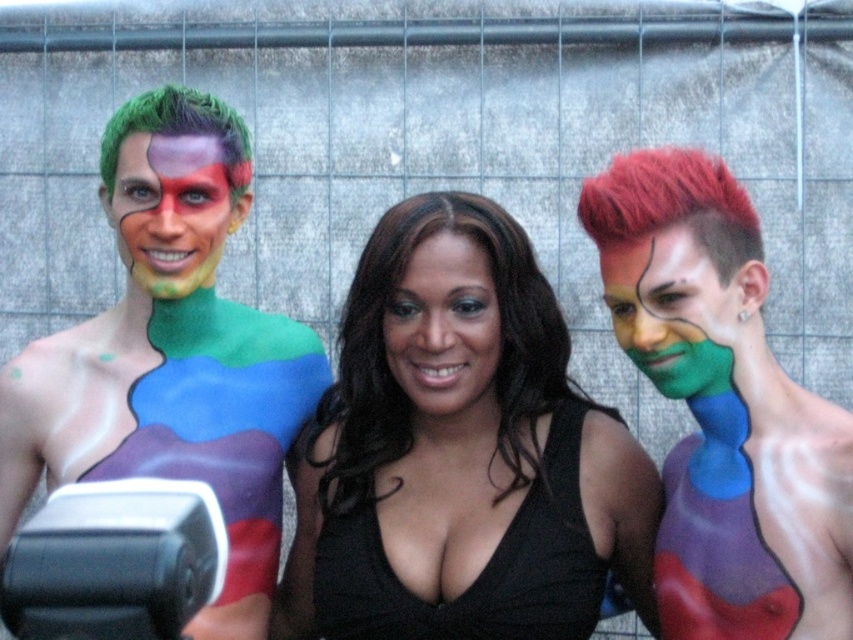
From the picture: You are a photographer standing 5 feet away from the camera. You want to take a photo of the shiny red hair at right. Can you reach it without moving your position?

The shiny red hair at right is 6.56 feet away from the camera. Since you are 5 feet away from the camera, the distance between you and the shiny red hair at right is 1.56 feet. Therefore, you can reach it without moving your position.

You are a photographer trying to position a light source for a portrait. The subject has black matte hair at center. According to the image, where should you place the light source to avoid harsh shadows on the subject?

The light source should be positioned away from the black matte hair at center to avoid harsh shadows. Since the subject is at point [456,440], placing the light opposite to that position would help reduce shadows.